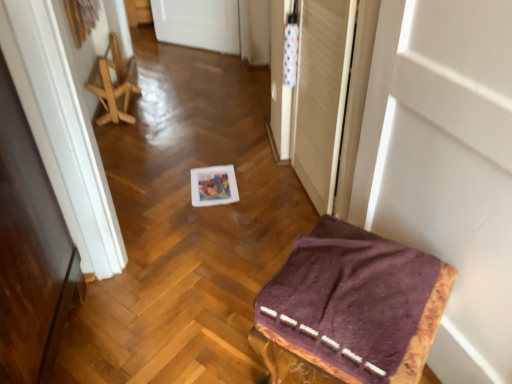
Image resolution: width=512 pixels, height=384 pixels. Find the location of `vacant region to the left of transparent plastic screen door at upper right`. vacant region to the left of transparent plastic screen door at upper right is located at coordinates (245, 194).